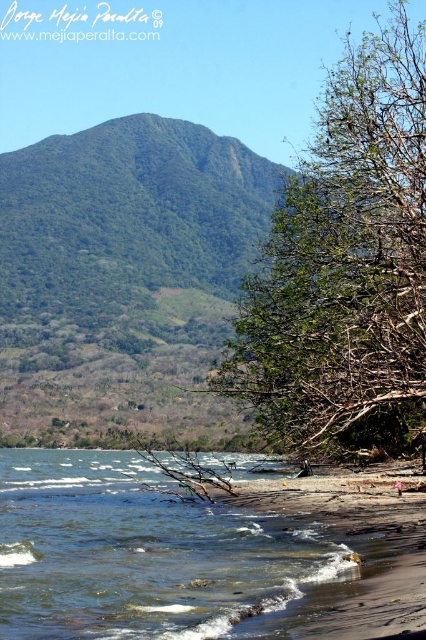
From the picture: Between green leafy tree at center and clear water at lower left, which one is positioned lower?

clear water at lower left

Between point (379, 381) and point (241, 620), which one is positioned behind?

Point (379, 381)

Find the location of a particular element. This screenshot has width=426, height=640. green leafy tree at center is located at coordinates (345, 264).